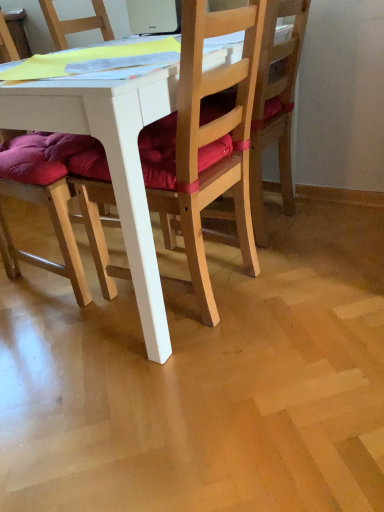
This screenshot has height=512, width=384. Identify the location of vacant space to the right of wooden chair at center, the 1th chair from the right. (340, 223).